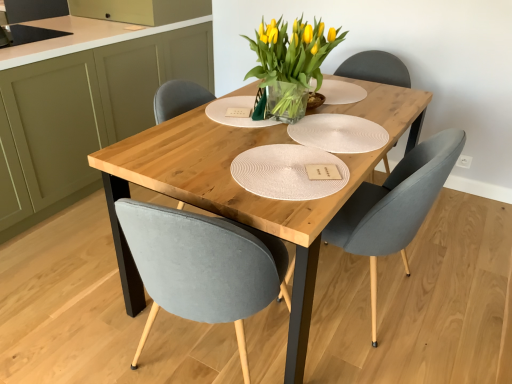
The image size is (512, 384). What do you see at coordinates (338, 133) in the screenshot?
I see `white textured paper plate at center` at bounding box center [338, 133].

Where is `white textured paper plate at center`? Image resolution: width=512 pixels, height=384 pixels. white textured paper plate at center is located at coordinates (338, 133).

Where is `natural wood table at center`? natural wood table at center is located at coordinates (246, 191).

Where is `matte olive green cabinet at left`? This screenshot has width=512, height=384. matte olive green cabinet at left is located at coordinates (91, 109).

From the picture: Considering the relative positions of matte olive green cabinet at left and natural wood table at center in the image provided, is matte olive green cabinet at left in front of natural wood table at center?

No, it is behind natural wood table at center.

Can natural wood table at center be found inside matte olive green cabinet at left?

No.

Can you confirm if matte olive green cabinet at left is taller than natural wood table at center?

Correct, matte olive green cabinet at left is much taller as natural wood table at center.

Considering the relative positions of matte olive green cabinet at left and velvet grey chair at center in the image provided, is matte olive green cabinet at left to the right of velvet grey chair at center from the viewer's perspective?

In fact, matte olive green cabinet at left is to the left of velvet grey chair at center.

Measure the distance from matte olive green cabinet at left to velvet grey chair at center.

They are 5.45 feet apart.

In terms of size, does matte olive green cabinet at left appear bigger or smaller than velvet grey chair at center?

matte olive green cabinet at left is bigger than velvet grey chair at center.

Looking at their sizes, would you say matte olive green cabinet at left is wider or thinner than velvet grey chair at center?

matte olive green cabinet at left is wider than velvet grey chair at center.

How different are the orientations of natural wood table at center and white textured paper plate at center in degrees?

natural wood table at center and white textured paper plate at center are facing 0.873 degrees away from each other.

Is natural wood table at center not near white textured paper plate at center?

No.

Do you think natural wood table at center is within white textured paper plate at center, or outside of it?

natural wood table at center is located beyond the bounds of white textured paper plate at center.

Considering the sizes of objects white textured paper plate at center and matte olive green cabinet at left in the image provided, who is wider, white textured paper plate at center or matte olive green cabinet at left?

matte olive green cabinet at left.

In the image, is white textured paper plate at center positioned in front of or behind matte olive green cabinet at left?

In the image, white textured paper plate at center appears in front of matte olive green cabinet at left.

Identify the location of paper plate above the matte olive green cabinet at left (from a real-world perspective). (338, 133).

Could you tell me if white textured paper plate at center is turned towards matte olive green cabinet at left?

No.

In terms of height, does translucent glass vase at center look taller or shorter compared to velvet grey chair at center?

translucent glass vase at center is shorter than velvet grey chair at center.

Which object is positioned more to the right, translucent glass vase at center or velvet grey chair at center?

velvet grey chair at center.

Does translucent glass vase at center contain velvet grey chair at center?

Definitely not — velvet grey chair at center is not inside translucent glass vase at center.

Considering the relative sizes of translucent glass vase at center and velvet grey chair at center in the image provided, is translucent glass vase at center wider than velvet grey chair at center?

No, translucent glass vase at center is not wider than velvet grey chair at center.

Considering the positions of objects white textured paper plate at center and velvet grey chair at center in the image provided, who is more to the left, white textured paper plate at center or velvet grey chair at center?

white textured paper plate at center.

Does white textured paper plate at center have a lesser height compared to velvet grey chair at center?

Yes.

From a real-world perspective, is white textured paper plate at center above or below velvet grey chair at center?

In terms of real-world spatial position, white textured paper plate at center is above velvet grey chair at center.

Could you tell me if natural wood table at center is facing translucent glass vase at center?

No, natural wood table at center is not aimed at translucent glass vase at center.

Locate an element on the screen. kitchen & dining room table on the right of translucent glass vase at center is located at coordinates (246, 191).

Is natural wood table at center bigger than translucent glass vase at center?

Indeed, natural wood table at center has a larger size compared to translucent glass vase at center.

Where is `cabinetry that is above the natural wood table at center (from the image's perspective)`? Image resolution: width=512 pixels, height=384 pixels. cabinetry that is above the natural wood table at center (from the image's perspective) is located at coordinates (91, 109).

This screenshot has width=512, height=384. What are the coordinates of `cabinetry that is behind the velvet grey chair at center` in the screenshot? It's located at (x=91, y=109).

When comparing their distances from velvet grey chair at center, does translucent glass vase at center or white textured paper plate at center seem closer?

white textured paper plate at center lies closer to velvet grey chair at center than the other object.

When comparing their distances from matte olive green cabinet at left, does translucent glass vase at center or velvet grey chair at center seem further?

The object further to matte olive green cabinet at left is velvet grey chair at center.

From the image, which object appears to be nearer to velvet grey chair at center, translucent glass vase at center or matte olive green cabinet at left?

The object closer to velvet grey chair at center is translucent glass vase at center.

Based on their spatial positions, is natural wood table at center or matte olive green cabinet at left closer to velvet grey chair at center?

Based on the image, natural wood table at center appears to be nearer to velvet grey chair at center.

Which object lies further to the anchor point matte olive green cabinet at left, white textured paper plate at center or velvet grey chair at center?

The object further to matte olive green cabinet at left is velvet grey chair at center.

Based on their spatial positions, is matte olive green cabinet at left or velvet grey chair at center further from translucent glass vase at center?

matte olive green cabinet at left.

Looking at the image, which one is located closer to velvet grey chair at center, natural wood table at center or white textured paper plate at center?

white textured paper plate at center lies closer to velvet grey chair at center than the other object.

When comparing their distances from white textured paper plate at center, does velvet grey chair at center or matte olive green cabinet at left seem further?

matte olive green cabinet at left is positioned further to the anchor white textured paper plate at center.

This screenshot has height=384, width=512. In order to click on kitchen & dining room table between matte olive green cabinet at left and velvet grey chair at center in this screenshot , I will do `click(246, 191)`.

Locate an element on the screen. Image resolution: width=512 pixels, height=384 pixels. kitchen & dining room table located between matte olive green cabinet at left and white textured paper plate at center in the left-right direction is located at coordinates (246, 191).

Where is `kitchen & dining room table that lies between white textured paper plate at center and velvet grey chair at center from top to bottom`? This screenshot has height=384, width=512. kitchen & dining room table that lies between white textured paper plate at center and velvet grey chair at center from top to bottom is located at coordinates (246, 191).

Identify the location of paper plate located between matte olive green cabinet at left and velvet grey chair at center in the left-right direction. (338, 133).